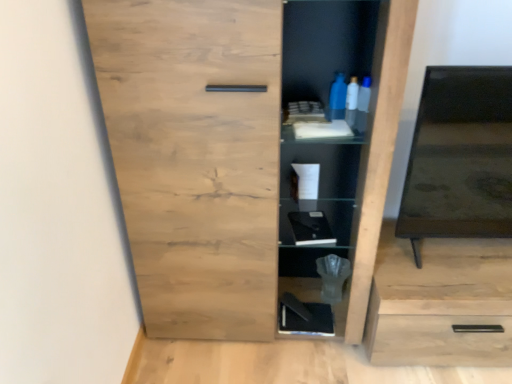
Where is `vacant space situated on the left part of black glossy tv at right`? This screenshot has width=512, height=384. vacant space situated on the left part of black glossy tv at right is located at coordinates (400, 268).